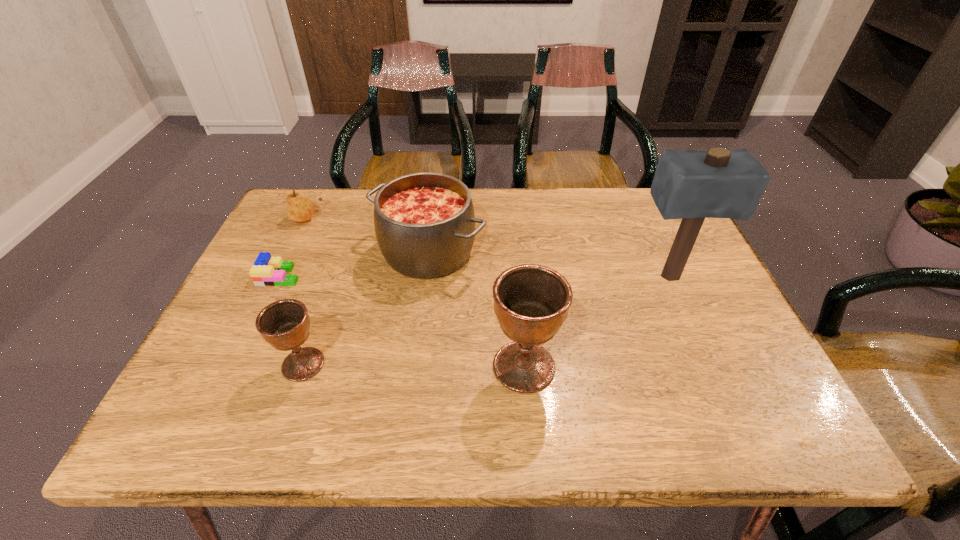
Locate an element on the screen. vacant region located 0.090m on the left of the right chalice is located at coordinates (447, 367).

Where is `vacant position located 0.360m on the right of the second shortest object`? The image size is (960, 540). vacant position located 0.360m on the right of the second shortest object is located at coordinates (445, 218).

The height and width of the screenshot is (540, 960). What are the coordinates of `vacant region located 0.160m on the right of the casserole` in the screenshot? It's located at (546, 252).

Locate an element on the screen. Image resolution: width=960 pixels, height=540 pixels. free region located 0.150m on the right of the Lego is located at coordinates (360, 275).

Image resolution: width=960 pixels, height=540 pixels. In order to click on free region located on the back of the rightmost object in this screenshot , I will do `click(640, 212)`.

Locate an element on the screen. The height and width of the screenshot is (540, 960). pear present at the far edge is located at coordinates (299, 208).

You are a GUI agent. You are given a task and a screenshot of the screen. Output one action in this format:
    pyautogui.click(x=<x>, y=<y>)
    Task: Click on the casserole located at the far edge
    This screenshot has width=960, height=540.
    Given the screenshot: What is the action you would take?
    pyautogui.click(x=424, y=222)

Where is `pear that is at the left edge`? The height and width of the screenshot is (540, 960). pear that is at the left edge is located at coordinates (299, 208).

You are a GUI agent. You are given a task and a screenshot of the screen. Output one action in this format:
    pyautogui.click(x=<x>, y=<y>)
    Task: Click on the Lego present at the left edge
    The width and height of the screenshot is (960, 540).
    Given the screenshot: What is the action you would take?
    pyautogui.click(x=266, y=271)

Image resolution: width=960 pixels, height=540 pixels. I want to click on object positioned at the right edge, so click(690, 185).